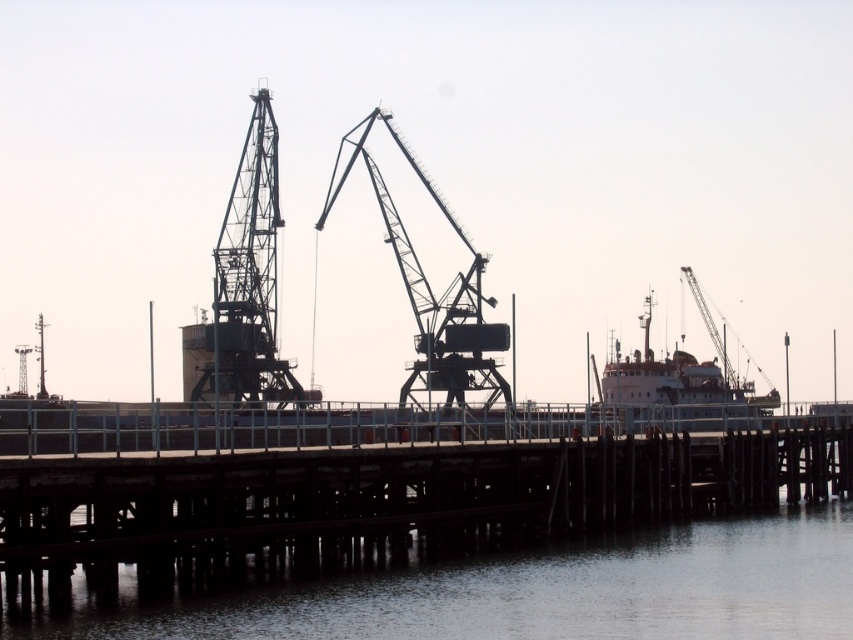
Question: Does transparent water at lower center have a larger size compared to white glossy ship at center?

Choices:
 (A) no
 (B) yes

Answer: (A)

Question: Which object is farther from the camera taking this photo?

Choices:
 (A) brown wooden dock at center
 (B) white glossy ship at center
 (C) metallic gray crane at center
 (D) metallic gray crane at center-left

Answer: (D)

Question: Is transparent water at lower center wider than metallic gray crane at center?

Choices:
 (A) no
 (B) yes

Answer: (B)

Question: Which object is the farthest from the metallic gray crane at center-left?

Choices:
 (A) white glossy ship at center
 (B) transparent water at lower center
 (C) brown wooden dock at center
 (D) metallic gray crane at center

Answer: (B)

Question: Which point appears closest to the camera in this image?

Choices:
 (A) (204, 596)
 (B) (407, 291)
 (C) (582, 442)
 (D) (196, 374)

Answer: (A)

Question: Can you confirm if metallic gray crane at center-left is thinner than metallic gray crane at center?

Choices:
 (A) no
 (B) yes

Answer: (B)